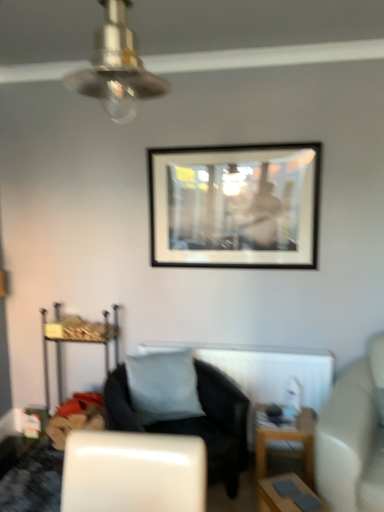
Question: Considering the positions of black matte picture frame at upper center and white matte radiator at center in the image, is black matte picture frame at upper center wider or thinner than white matte radiator at center?

Choices:
 (A) wide
 (B) thin

Answer: (B)

Question: Is point (160, 148) positioned closer to the camera than point (276, 400)?

Choices:
 (A) closer
 (B) farther

Answer: (B)

Question: Which is farther from the metallic silver ceiling fan at upper center?

Choices:
 (A) white matte radiator at center
 (B) metallic gold dresser at left
 (C) white matte pillow at center
 (D) wooden table at lower right, the second table from the front
 (E) black matte picture frame at upper center

Answer: (B)

Question: Which object is the closest to the metallic gold dresser at left?

Choices:
 (A) black matte picture frame at upper center
 (B) metallic silver ceiling fan at upper center
 (C) black fabric chair at center
 (D) white matte radiator at center
 (E) white leather couch at right

Answer: (C)